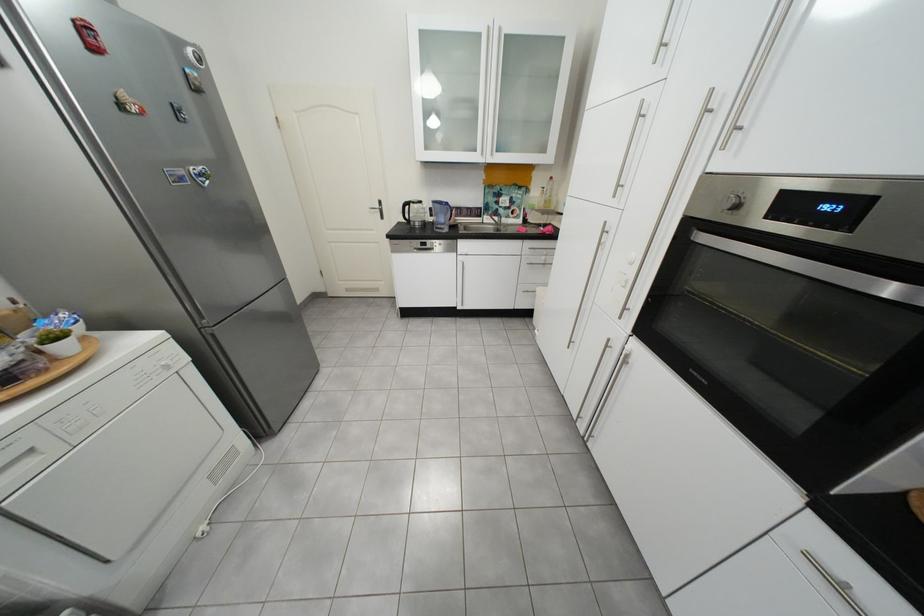
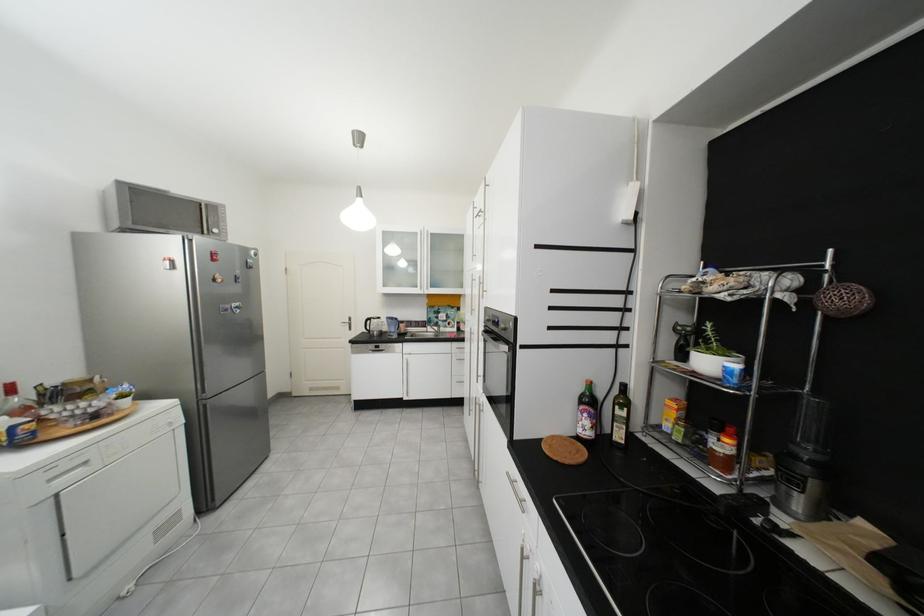
In the second image, find the point that corresponds to pixel 477 214 in the first image.

(426, 325)